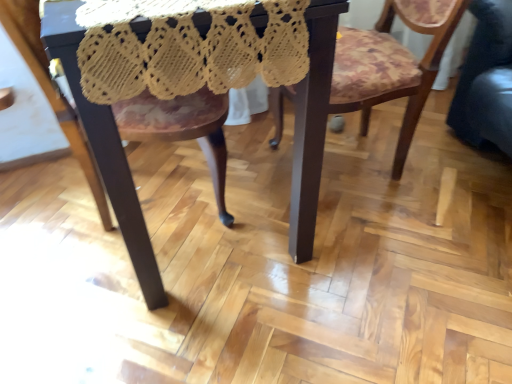
Locate an element on the screen. empty space that is in between dark brown polished wood table at center and wooden chair at center, which is counted as the first chair, starting from the left is located at coordinates (109, 267).